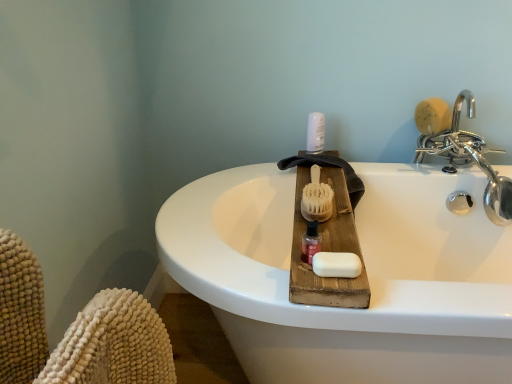
Question: Considering the relative positions of white plastic bottle at upper center and wooden bristle brush at center, the 1th brush in the left-to-right sequence, in the image provided, is white plastic bottle at upper center in front of wooden bristle brush at center, the 1th brush in the left-to-right sequence,?

Choices:
 (A) yes
 (B) no

Answer: (B)

Question: Is wooden bristle brush at center, marked as the first brush in a bottom-to-top arrangement, completely or partially inside white plastic bottle at upper center?

Choices:
 (A) yes
 (B) no

Answer: (B)

Question: From the image's perspective, is white plastic bottle at upper center beneath wooden bristle brush at center, acting as the second brush starting from the right?

Choices:
 (A) yes
 (B) no

Answer: (B)

Question: Would you say white plastic bottle at upper center is outside wooden bristle brush at center, which is counted as the first brush, starting from the front?

Choices:
 (A) no
 (B) yes

Answer: (B)

Question: Is white plastic bottle at upper center shorter than wooden bristle brush at center, the 2th brush from the back?

Choices:
 (A) yes
 (B) no

Answer: (B)

Question: Is natural wood brush at upper right, marked as the first brush in a right-to-left arrangement, taller or shorter than wooden bristle brush at center, which appears as the second brush when viewed from the top?

Choices:
 (A) tall
 (B) short

Answer: (A)

Question: Considering the positions of point (435, 99) and point (328, 185), is point (435, 99) closer or farther from the camera than point (328, 185)?

Choices:
 (A) farther
 (B) closer

Answer: (A)

Question: Relative to wooden bristle brush at center, the 2th brush from the back, is natural wood brush at upper right, positioned as the second brush in left-to-right order, in front or behind?

Choices:
 (A) behind
 (B) front

Answer: (A)

Question: Considering the relative positions of natural wood brush at upper right, positioned as the second brush in left-to-right order, and wooden bristle brush at center, the 2th brush from the back, in the image provided, is natural wood brush at upper right, positioned as the second brush in left-to-right order, to the left or to the right of wooden bristle brush at center, the 2th brush from the back,?

Choices:
 (A) left
 (B) right

Answer: (B)

Question: From the image's perspective, is chrome metallic faucet at upper right located above or below white plastic bottle at upper center?

Choices:
 (A) below
 (B) above

Answer: (A)

Question: Is chrome metallic faucet at upper right taller or shorter than white plastic bottle at upper center?

Choices:
 (A) short
 (B) tall

Answer: (B)

Question: Considering the relative positions of chrome metallic faucet at upper right and white plastic bottle at upper center in the image provided, is chrome metallic faucet at upper right to the left or to the right of white plastic bottle at upper center?

Choices:
 (A) left
 (B) right

Answer: (B)

Question: Choose the correct answer: Is chrome metallic faucet at upper right inside white plastic bottle at upper center or outside it?

Choices:
 (A) outside
 (B) inside

Answer: (A)

Question: From their relative heights in the image, would you say wooden bristle brush at center, which appears as the second brush when viewed from the top, is taller or shorter than natural wood brush at upper right, the 1th brush from the top?

Choices:
 (A) tall
 (B) short

Answer: (B)

Question: From the image's perspective, is wooden bristle brush at center, which is counted as the first brush, starting from the front, above or below natural wood brush at upper right, the 1th brush from the top?

Choices:
 (A) above
 (B) below

Answer: (B)